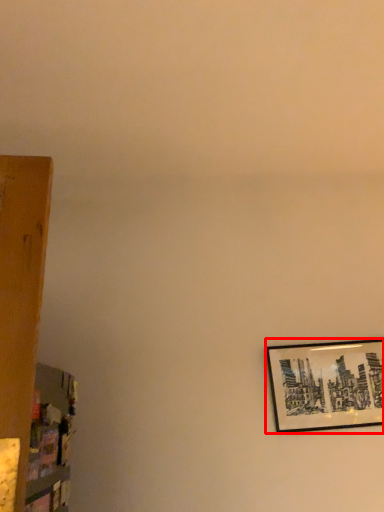
Question: Considering the relative positions of picture frame (annotated by the red box) and shelf in the image provided, where is picture frame (annotated by the red box) located with respect to the staircase?

Choices:
 (A) right
 (B) left

Answer: (A)